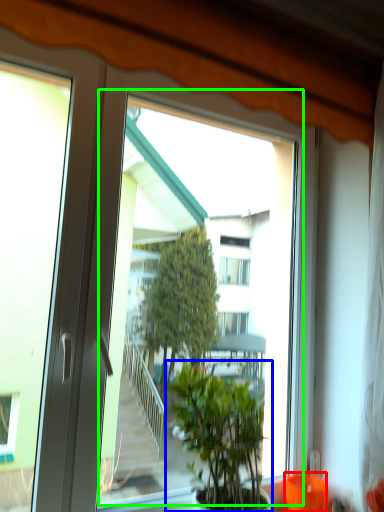
Question: Which is farther away from glass vase (highlighted by a red box)? houseplant (highlighted by a blue box) or window screen (highlighted by a green box)?

Choices:
 (A) houseplant
 (B) window screen

Answer: (B)